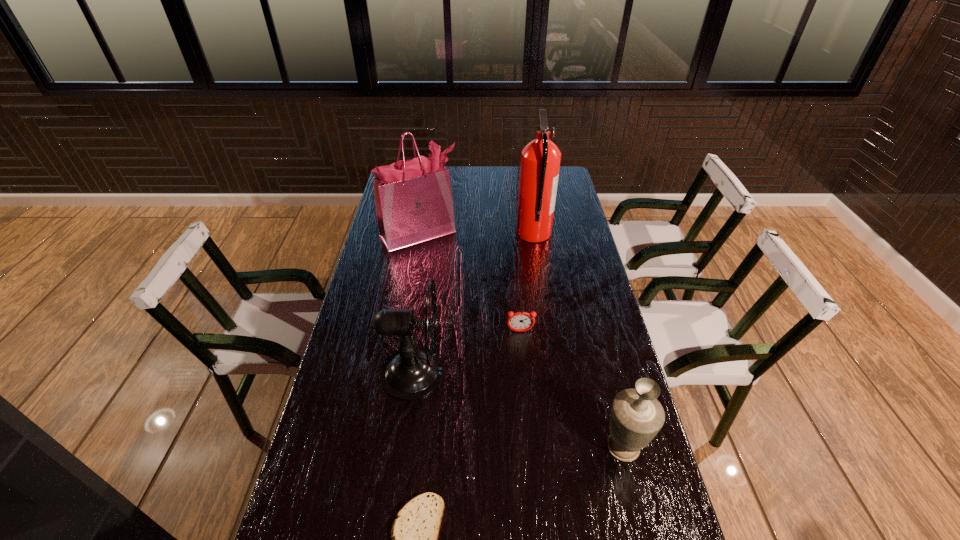
The height and width of the screenshot is (540, 960). Find the location of `free space located at the nozzle of the fire extinguisher`. free space located at the nozzle of the fire extinguisher is located at coordinates (504, 233).

Image resolution: width=960 pixels, height=540 pixels. I want to click on vacant space located 0.140m on the right of the shopping bag, so click(x=492, y=234).

Locate an element on the screen. vacant region located on the front-facing side of the third tallest object is located at coordinates (510, 372).

You are a GUI agent. You are given a task and a screenshot of the screen. Output one action in this format:
    pyautogui.click(x=<x>, y=<y>)
    Task: Click on the vacant space located on the left of the rightmost object
    This screenshot has width=960, height=540.
    Given the screenshot: What is the action you would take?
    pyautogui.click(x=557, y=447)

This screenshot has height=540, width=960. What are the coordinates of `vacant region located 0.210m on the front-facing side of the alarm clock` in the screenshot? It's located at (525, 390).

The image size is (960, 540). What are the coordinates of `shopping bag that is positioned at the left edge` in the screenshot? It's located at (413, 198).

Where is `fan present at the left edge`? The width and height of the screenshot is (960, 540). fan present at the left edge is located at coordinates (412, 372).

You are a GUI agent. You are given a task and a screenshot of the screen. Output one action in this format:
    pyautogui.click(x=<x>, y=<y>)
    Task: Click on the fire extinguisher that is at the right edge
    
    Given the screenshot: What is the action you would take?
    pyautogui.click(x=540, y=159)

Find the location of a particular element. This screenshot has height=540, width=960. urn located in the right edge section of the desktop is located at coordinates (636, 417).

Identify the location of free region at the left edge of the desktop. This screenshot has height=540, width=960. (381, 250).